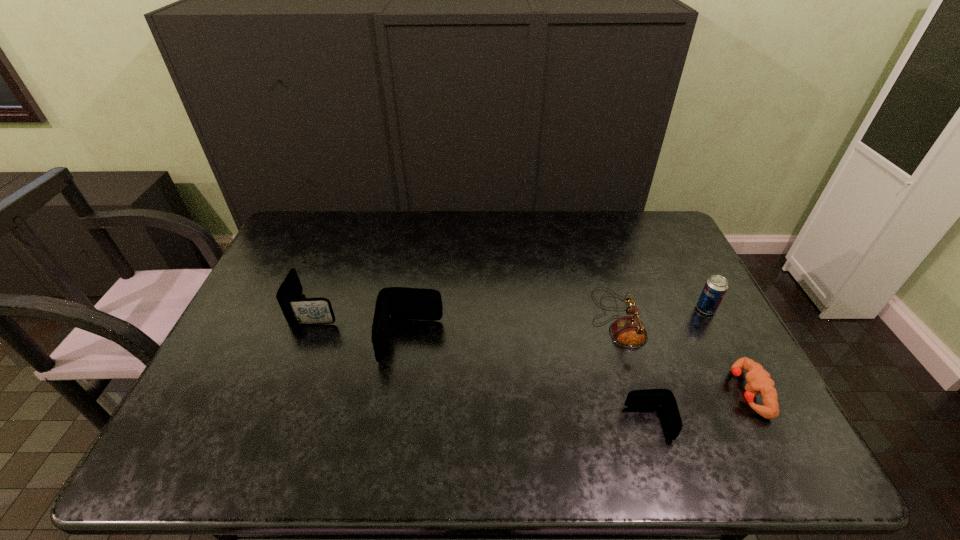
Locate an element on the screen. Image resolution: width=960 pixels, height=540 pixels. free space between the second tallest wallet and the nearest wallet is located at coordinates (483, 366).

I want to click on free space between the beer can and the rightmost wallet, so click(677, 366).

At what (x,y) coordinates should I click in order to perform the action: click on empty location between the puncher and the leftmost object. Please return your answer as a coordinate pair (x, y). Looking at the image, I should click on (533, 350).

Locate an element on the screen. The width and height of the screenshot is (960, 540). vacant space in between the puncher and the telephone is located at coordinates (683, 355).

Find the location of a particular element. unoccupied area between the second wallet from left to right and the beer can is located at coordinates (558, 325).

Locate an element on the screen. The width and height of the screenshot is (960, 540). free space between the telephone and the second shortest wallet is located at coordinates (467, 313).

Where is `vacant space in between the beer can and the second object from left to right`? The image size is (960, 540). vacant space in between the beer can and the second object from left to right is located at coordinates (558, 325).

In order to click on free space that is in between the nearest wallet and the telephone in this screenshot , I will do `click(633, 371)`.

You are a GUI agent. You are given a task and a screenshot of the screen. Output one action in this format:
    pyautogui.click(x=<x>, y=<y>)
    Task: Click on the free space between the telephone and the puncher
    
    Given the screenshot: What is the action you would take?
    pyautogui.click(x=683, y=355)

You are a GUI agent. You are given a task and a screenshot of the screen. Output one action in this format:
    pyautogui.click(x=<x>, y=<y>)
    Task: Click on the vacant area that lies between the second wallet from right to left and the telephone
    This screenshot has width=960, height=540.
    Given the screenshot: What is the action you would take?
    pyautogui.click(x=514, y=329)